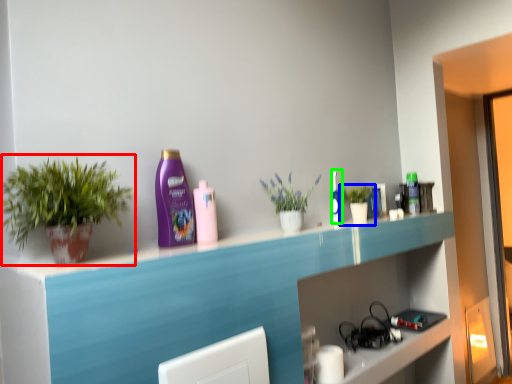
Question: Estimate the real-world distances between objects in this image. Which object is closer to houseplant (highlighted by a red box), houseplant (highlighted by a blue box) or mouthwash (highlighted by a green box)?

Choices:
 (A) houseplant
 (B) mouthwash

Answer: (B)